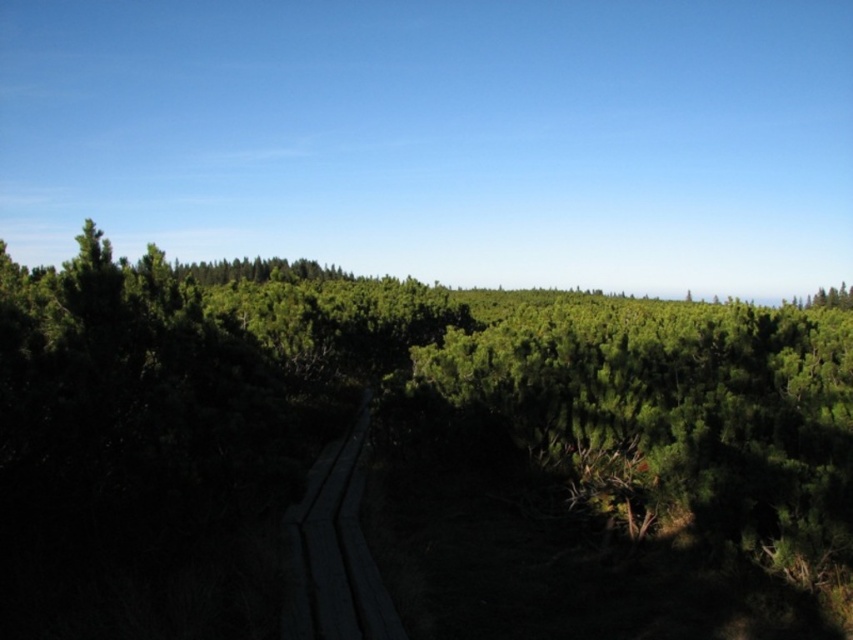
What are the coordinates of `green textured forest at center` in the screenshot? It's located at (410, 456).

Between green textured forest at center and dark wood boardwalk at center, which one appears on the left side from the viewer's perspective?

Positioned to the left is dark wood boardwalk at center.

Does point (3, 518) come behind point (389, 602)?

No.

Identify the location of green textured forest at center. This screenshot has height=640, width=853. (410, 456).